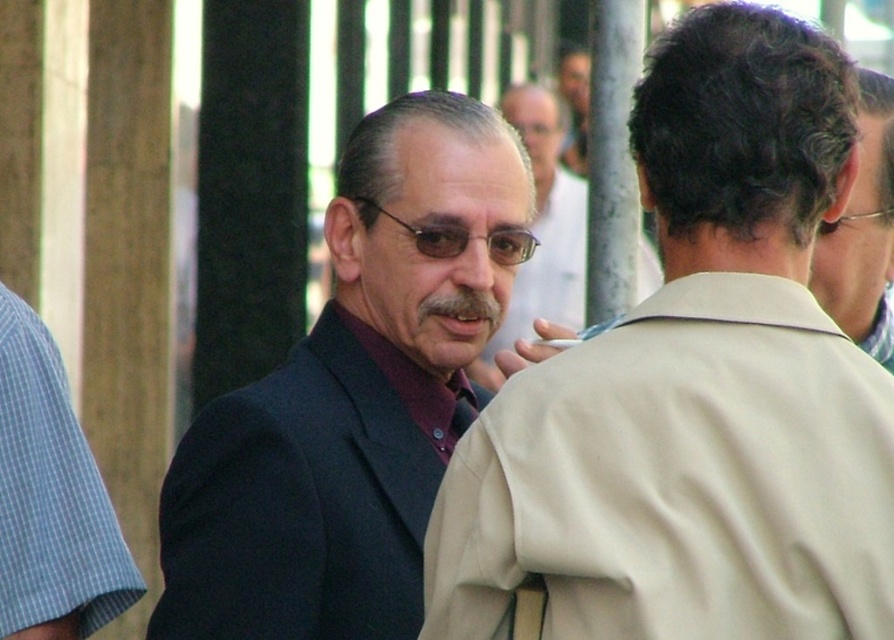
Question: Among these points, which one is farthest from the camera?

Choices:
 (A) (228, 516)
 (B) (551, 276)
 (C) (875, 244)

Answer: (B)

Question: From the image, what is the correct spatial relationship of dark blue suit at center in relation to dark brown hair at upper right?

Choices:
 (A) above
 (B) below

Answer: (B)

Question: Which object is positioned closest to the dark brown hair at upper right?

Choices:
 (A) dark blue suit at center
 (B) beige smooth trench coat at center

Answer: (A)

Question: Does beige smooth trench coat at center have a smaller size compared to dark blue suit at center?

Choices:
 (A) no
 (B) yes

Answer: (B)

Question: Is dark blue suit at center thinner than dark brown hair at upper right?

Choices:
 (A) yes
 (B) no

Answer: (B)

Question: Which point is closer to the camera taking this photo?

Choices:
 (A) (876, 449)
 (B) (824, 273)
 (C) (477, 248)

Answer: (A)